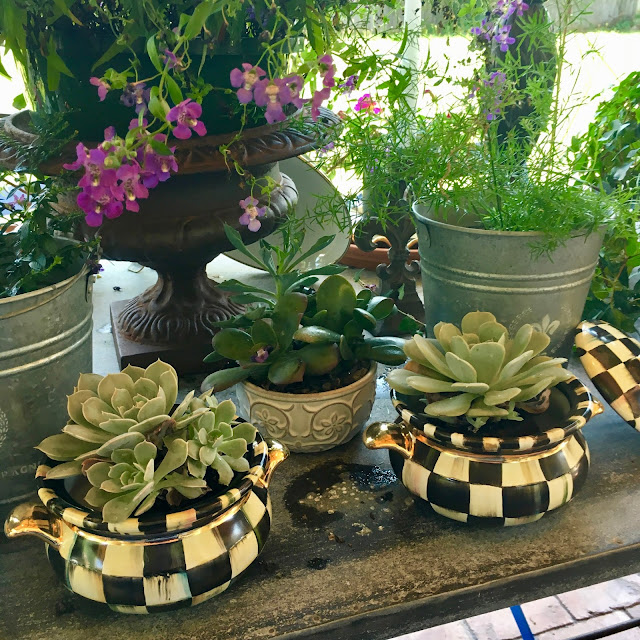
The image size is (640, 640). What are the coordinates of `flower pots` in the screenshot? It's located at (470, 473), (201, 556).